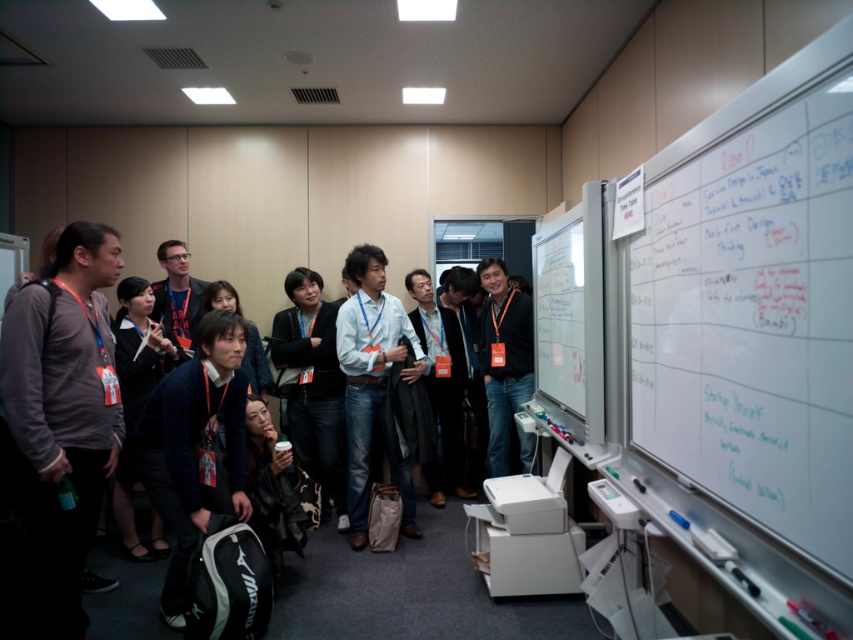
Is gray matte shirt at left further to camera compared to dark gray sweater at center?

No, it is in front of dark gray sweater at center.

Is gray matte shirt at left below dark gray sweater at center?

Incorrect, gray matte shirt at left is not positioned below dark gray sweater at center.

You are a GUI agent. You are given a task and a screenshot of the screen. Output one action in this format:
    pyautogui.click(x=<x>, y=<y>)
    Task: Click on the gray matte shirt at left
    The height and width of the screenshot is (640, 853).
    Given the screenshot: What is the action you would take?
    pyautogui.click(x=62, y=412)

Is gray matte shirt at left shorter than black matte jacket at center?

Incorrect, gray matte shirt at left's height does not fall short of black matte jacket at center's.

Does point (84, 339) come closer to viewer compared to point (523, 452)?

Yes, point (84, 339) is in front of point (523, 452).

Is point (48, 518) positioned before point (497, 472)?

Yes.

The height and width of the screenshot is (640, 853). I want to click on gray matte shirt at left, so click(62, 412).

The width and height of the screenshot is (853, 640). I want to click on whiteboard at upper right, so click(753, 304).

Is point (836, 355) positioned before point (90, 440)?

Yes, point (836, 355) is closer to viewer.

Where is `whiteboard at upper right`? whiteboard at upper right is located at coordinates (753, 304).